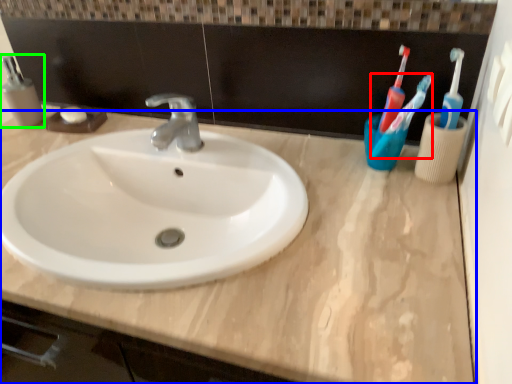
Question: Estimate the real-world distances between objects in this image. Which object is farther from toothbrush (highlighted by a red box), counter top (highlighted by a blue box) or mouthwash (highlighted by a green box)?

Choices:
 (A) counter top
 (B) mouthwash

Answer: (B)